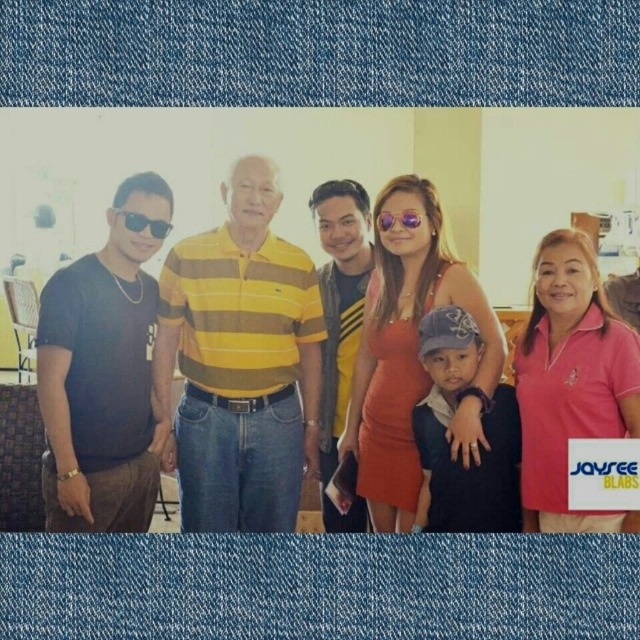
Question: Among these objects, which one is nearest to the camera?

Choices:
 (A) sunglasses at center
 (B) matte black sunglasses at left

Answer: (B)

Question: In this image, where is dark blue denim jeans at center located relative to sunglasses at center?

Choices:
 (A) right
 (B) left

Answer: (A)

Question: In this image, where is matte yellow striped polo shirt at center located relative to dark blue denim jeans at center?

Choices:
 (A) below
 (B) above

Answer: (B)

Question: Which of these objects is positioned farthest from the dark blue denim jeans at center?

Choices:
 (A) matte yellow striped polo shirt at center
 (B) sunglasses at center

Answer: (A)

Question: Which of the following is the farthest from the observer?

Choices:
 (A) dark blue denim jeans at center
 (B) matte black sunglasses at left

Answer: (B)

Question: Observing the image, what is the correct spatial positioning of matte black sunglasses at left in reference to sunglasses at center?

Choices:
 (A) right
 (B) left

Answer: (B)